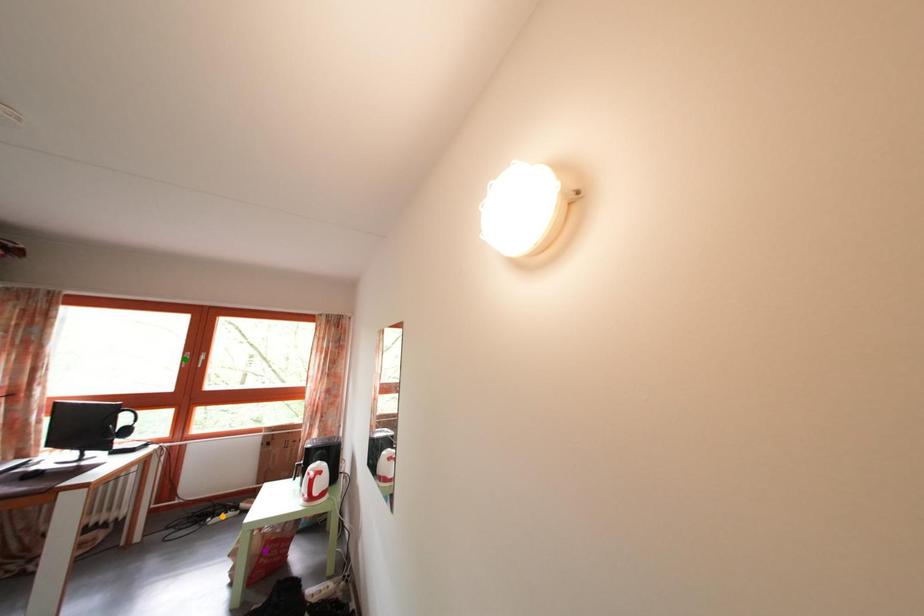
Order these from nearest to farthest:
green point, orange point, purple point

purple point < orange point < green point